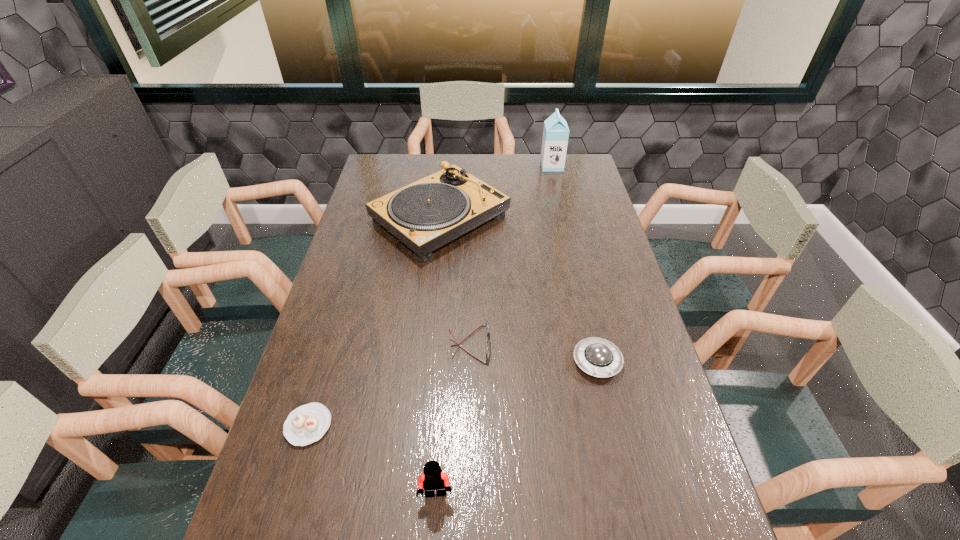
The height and width of the screenshot is (540, 960). What are the coordinates of `free space located 0.290m on the right of the cupcake` in the screenshot? It's located at (454, 426).

This screenshot has width=960, height=540. Identify the location of free space located 0.240m on the front-facing side of the spectacles. (579, 344).

Where is `milk carton that is at the far edge`? milk carton that is at the far edge is located at coordinates (556, 132).

Image resolution: width=960 pixels, height=540 pixels. Identify the location of record player that is positioned at the far edge. (429, 213).

Identify the location of record player at the left edge. This screenshot has width=960, height=540. (429, 213).

The width and height of the screenshot is (960, 540). In order to click on cupcake located at the left edge in this screenshot , I will do `click(306, 424)`.

I want to click on milk carton at the right edge, so [x=556, y=132].

Find the location of `saucer that is at the right edge`. saucer that is at the right edge is located at coordinates (598, 357).

At what (x,y) coordinates should I click in order to perform the action: click on object located in the far left corner section of the desktop. Please return your answer as a coordinate pair (x, y). This screenshot has width=960, height=540. Looking at the image, I should click on (429, 213).

Identify the location of object that is at the far right corner. The height and width of the screenshot is (540, 960). (556, 132).